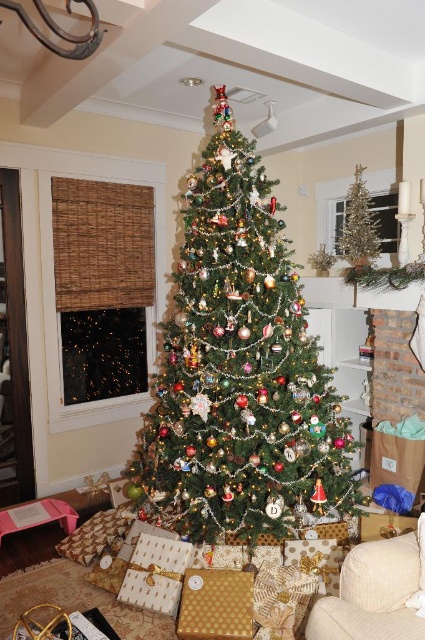
You are planning to place a new gift box next to the gold textured gift at lower center. Given the space available, will the green matte christmas tree at center interfere with the placement?

The green matte christmas tree at center is wider than the gold textured gift at lower center, so placing the new gift box next to the gold textured gift at lower center may be possible as the tree is wider but positioned centrally, allowing space around its base for the gift.

You are a guest at a Christmas party and see the gold textured gift at lower center and the gold textured tree at center. Which one is taller?

The gold textured tree at center is taller than the gold textured gift at lower center.

You are sitting in the beige fabric armchair at lower right and want to reach the gold textured gift at lower center. Is the gift directly under your seat?

Yes, the beige fabric armchair at lower right is positioned over the gold textured gift at lower center, so the gift is directly under your seat.